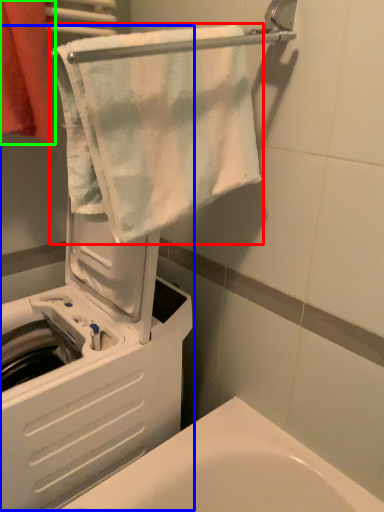
Question: Which object is positioned farthest from towel (highlighted by a red box)? Select from machine (highlighted by a blue box) and towel (highlighted by a green box).

Choices:
 (A) machine
 (B) towel

Answer: (A)